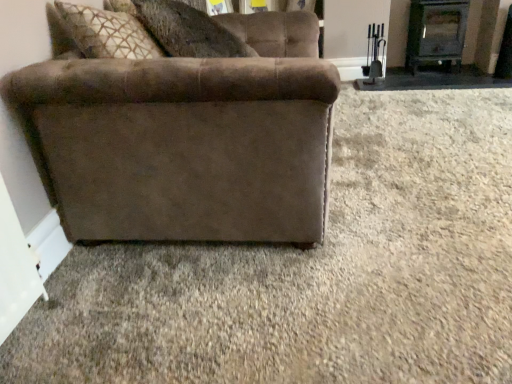
Question: From the image's perspective, is suede-like brown pillow at upper center positioned above or below suede brown couch at left?

Choices:
 (A) below
 (B) above

Answer: (B)

Question: Is point (157, 36) closer or farther from the camera than point (84, 124)?

Choices:
 (A) farther
 (B) closer

Answer: (A)

Question: Estimate the real-world distances between objects in this image. Which object is farther from the suede-like brown pillow at upper center?

Choices:
 (A) black metal fireplace at upper right
 (B) suede brown couch at left

Answer: (A)

Question: Which object is the closest to the black metal fireplace at upper right?

Choices:
 (A) suede-like brown pillow at upper center
 (B) suede brown couch at left

Answer: (A)